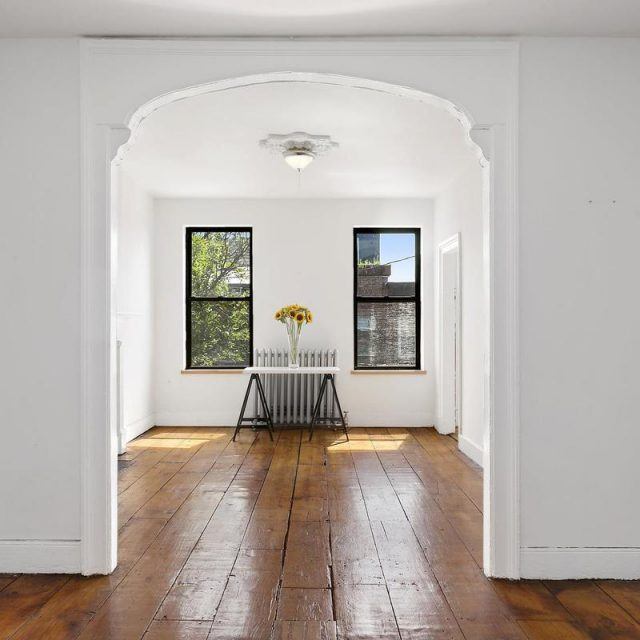
Where is `radiator`? Image resolution: width=640 pixels, height=640 pixels. radiator is located at coordinates (292, 393).